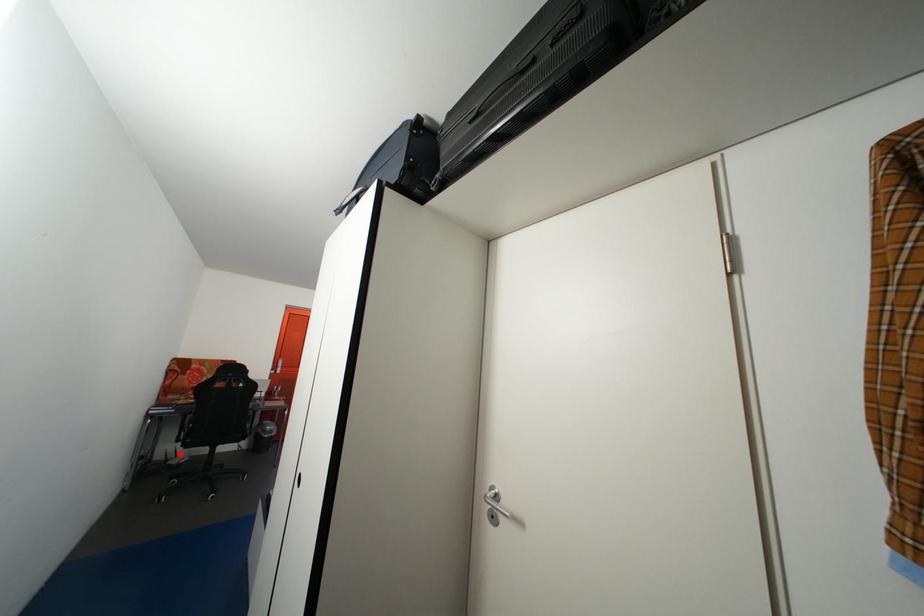
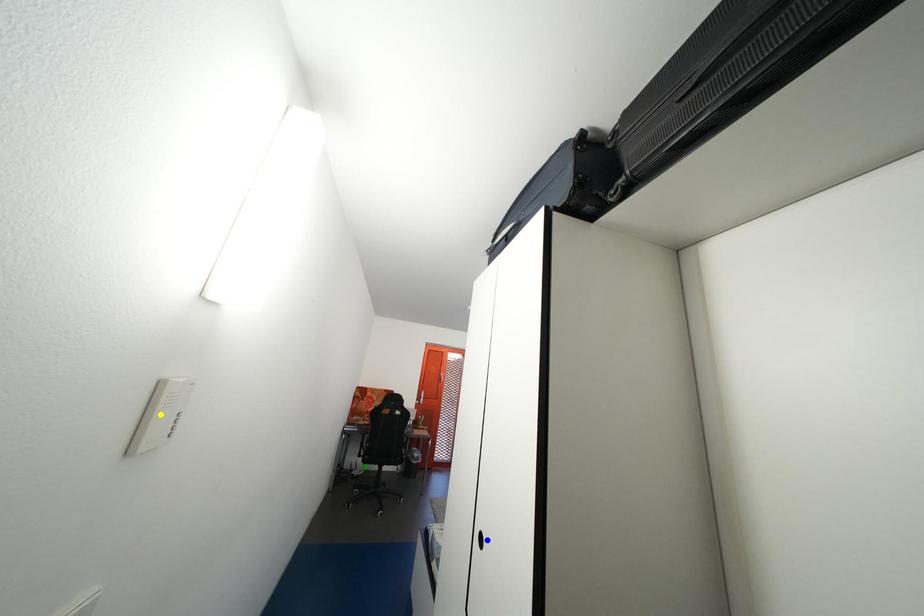
Question: I am providing you with two images of the same scene from different viewpoints. A red point is marked on the first image. You are given multiple points on the second image. Which mark in image 2 goes with the point in image 1?

Choices:
 (A) green point
 (B) yellow point
 (C) blue point

Answer: (A)